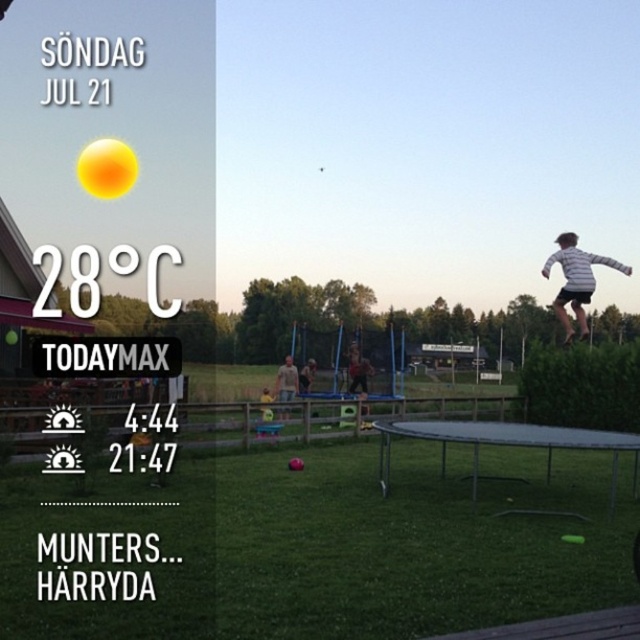
Who is positioned more to the left, metallic trampoline at center or striped cotton shirt at upper right?

metallic trampoline at center is more to the left.

Is metallic trampoline at center smaller than striped cotton shirt at upper right?

Yes, metallic trampoline at center is smaller than striped cotton shirt at upper right.

Measure the distance between point (x=616, y=460) and camera.

Point (x=616, y=460) and camera are 12.28 meters apart.

Find the location of a particular element. This screenshot has width=640, height=640. metallic trampoline at center is located at coordinates (506, 444).